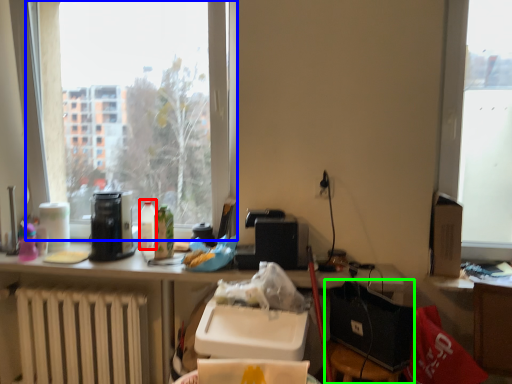
Question: Which object is the farthest from bottle (highlighted by a red box)? Choose among these: window (highlighted by a blue box) or chair (highlighted by a green box).

Choices:
 (A) window
 (B) chair

Answer: (A)